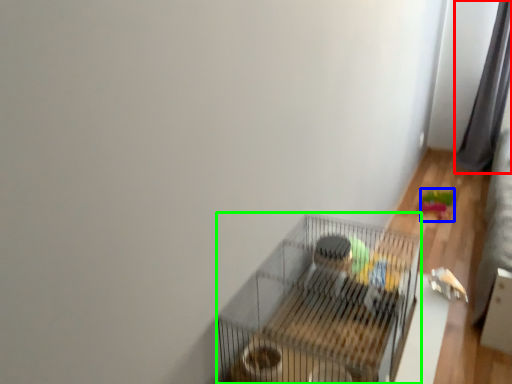
Question: Considering the real-world distances, which object is closest to curtain (highlighted by a red box)? toy (highlighted by a blue box) or bird cage (highlighted by a green box).

Choices:
 (A) toy
 (B) bird cage

Answer: (A)